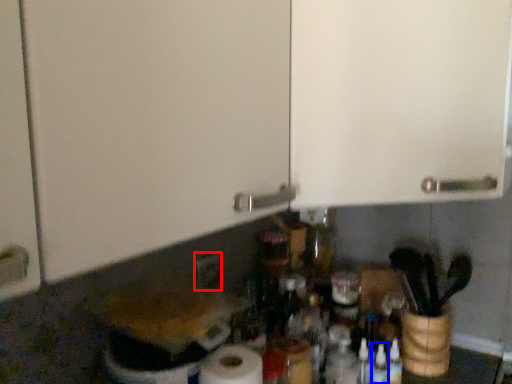
Question: Among these objects, which one is farthest to the camera, electric outlet (highlighted by a red box) or bottle (highlighted by a blue box)?

Choices:
 (A) electric outlet
 (B) bottle

Answer: (A)